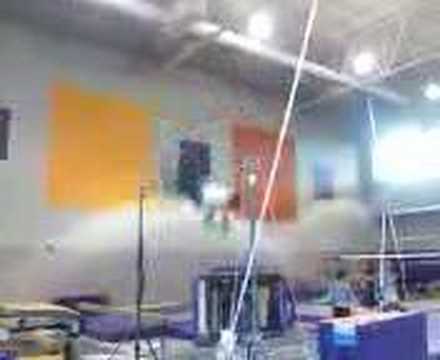
Find the location of `yellow wall covering`. yellow wall covering is located at coordinates (97, 126).